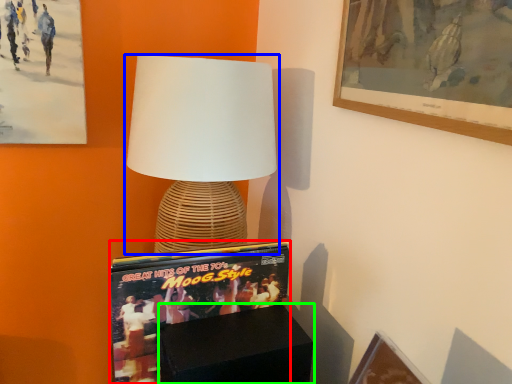
Question: Which object is positioned farthest from magazine (highlighted by a red box)? Select from lamp (highlighted by a blue box) and furniture (highlighted by a green box).

Choices:
 (A) lamp
 (B) furniture

Answer: (A)